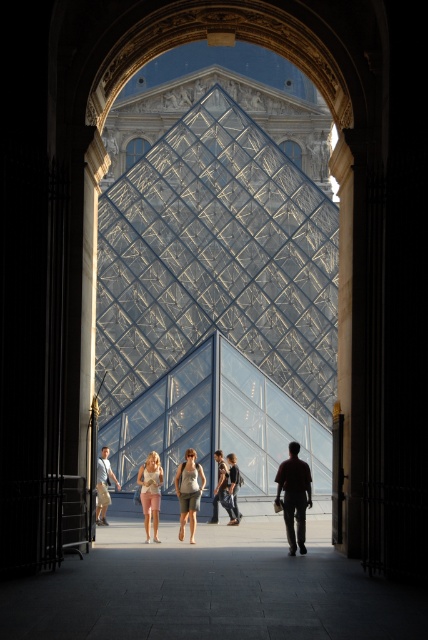
You are standing at the entrance of a building with an arched doorway. There is a white marble pillar at right. Can you tell me where the point at coordinate (344, 289) is located?

The point at coordinate (344, 289) is located on the white marble pillar at right.

You are standing in a hallway with an arched doorway ahead. You see a person wearing light beige shorts at center and light brown leather jacket at center through the doorway. Which clothing item is closer to you?

The light beige shorts at center is closer to the viewer than the light brown leather jacket at center.

You are standing in front of the arched doorway and see two points marked in the scene. Which point, point (101,500) or point (222,458), is closer to you?

Point (101,500) is closer to the viewer than point (222,458).